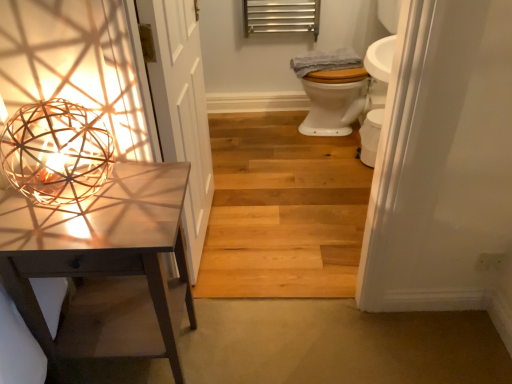
Question: Is white wood door at left located outside metallic silver radiator at upper center?

Choices:
 (A) no
 (B) yes

Answer: (B)

Question: Is white wood door at left wider than metallic silver radiator at upper center?

Choices:
 (A) no
 (B) yes

Answer: (A)

Question: Does white wood door at left have a smaller size compared to metallic silver radiator at upper center?

Choices:
 (A) yes
 (B) no

Answer: (B)

Question: Considering the relative positions of white wood door at left and metallic silver radiator at upper center in the image provided, is white wood door at left to the right of metallic silver radiator at upper center from the viewer's perspective?

Choices:
 (A) yes
 (B) no

Answer: (B)

Question: Could metallic silver radiator at upper center be considered to be inside white wood door at left?

Choices:
 (A) yes
 (B) no

Answer: (B)

Question: Looking at the image, does metallic silver radiator at upper center seem bigger or smaller compared to white wood door at left?

Choices:
 (A) small
 (B) big

Answer: (A)

Question: Considering the positions of point (252, 8) and point (190, 273), is point (252, 8) closer or farther from the camera than point (190, 273)?

Choices:
 (A) closer
 (B) farther

Answer: (B)

Question: Do you think metallic silver radiator at upper center is within white wood door at left, or outside of it?

Choices:
 (A) inside
 (B) outside

Answer: (B)

Question: From the image's perspective, is metallic silver radiator at upper center above or below white wood door at left?

Choices:
 (A) below
 (B) above

Answer: (B)

Question: From a real-world perspective, is matte white table at left positioned above or below white wood door at left?

Choices:
 (A) above
 (B) below

Answer: (B)

Question: Is matte white table at left wider or thinner than white wood door at left?

Choices:
 (A) thin
 (B) wide

Answer: (B)

Question: Is matte white table at left taller or shorter than white wood door at left?

Choices:
 (A) tall
 (B) short

Answer: (B)

Question: Is point (159, 254) closer or farther from the camera than point (197, 38)?

Choices:
 (A) closer
 (B) farther

Answer: (A)

Question: Is point (9, 122) closer or farther from the camera than point (252, 139)?

Choices:
 (A) closer
 (B) farther

Answer: (A)

Question: From the image's perspective, is woven wood sphere at left located above or below natural wood floor at center?

Choices:
 (A) below
 (B) above

Answer: (A)